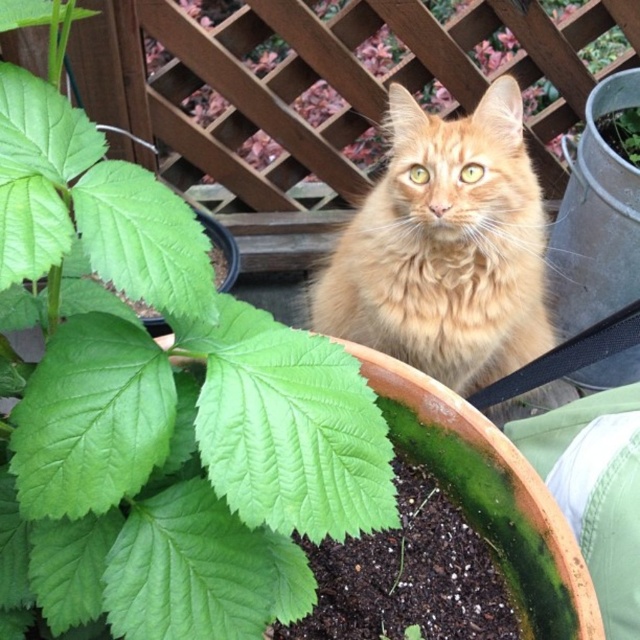
Who is lower down, green matte leaf at center or golden fur cat at center?

green matte leaf at center is lower down.

Is point (310, 420) positioned in front of point (440, 365)?

Yes, point (310, 420) is in front of point (440, 365).

Does point (372, 476) come farther from viewer compared to point (435, 282)?

No, (372, 476) is closer to viewer.

Where is `green matte leaf at center`? Image resolution: width=640 pixels, height=640 pixels. green matte leaf at center is located at coordinates (156, 408).